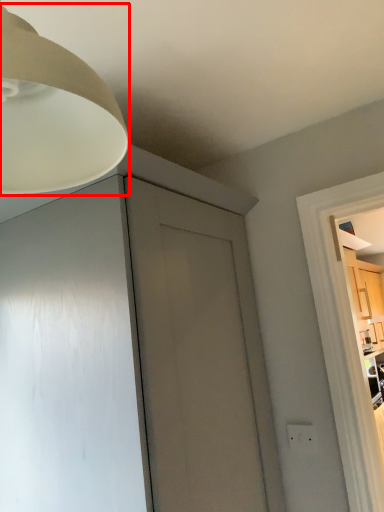
Question: From the image's perspective, considering the relative positions of lamp (annotated by the red box) and electric outlet in the image provided, where is lamp (annotated by the red box) located with respect to the staircase?

Choices:
 (A) above
 (B) below

Answer: (A)